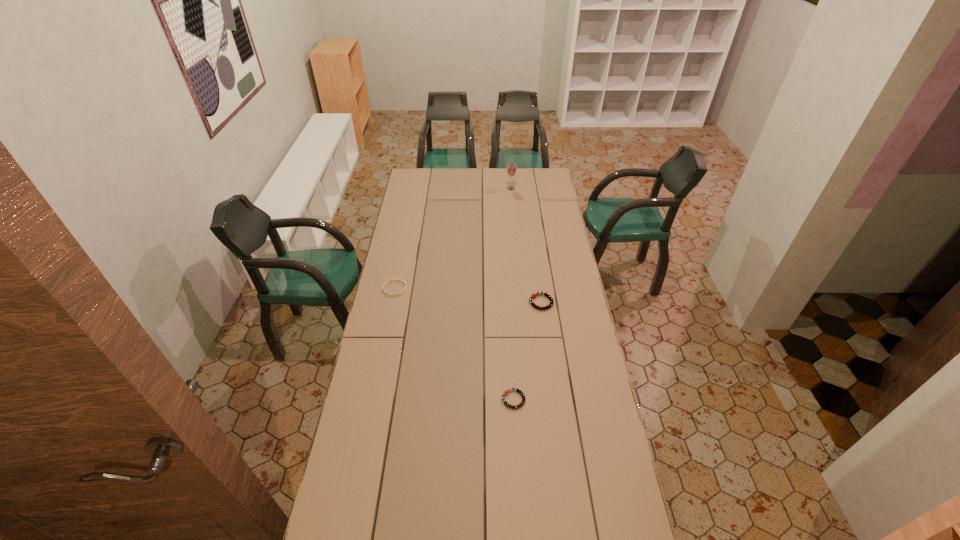
The width and height of the screenshot is (960, 540). I want to click on object located at the far edge, so click(x=511, y=168).

The width and height of the screenshot is (960, 540). I want to click on object that is at the left edge, so click(x=386, y=282).

Find the location of `object situated at the right edge`. object situated at the right edge is located at coordinates (533, 296).

Locate an element on the screen. Image resolution: width=960 pixels, height=540 pixels. vacant region at the far edge is located at coordinates (451, 177).

Where is `vacant area at the left edge`? Image resolution: width=960 pixels, height=540 pixels. vacant area at the left edge is located at coordinates (348, 424).

In the image, there is a desktop. Where is `vacant space at the right edge`? vacant space at the right edge is located at coordinates (541, 199).

In the image, there is a desktop. At what (x,y) coordinates should I click in order to perform the action: click on vacant space at the far left corner. Please return your answer as a coordinate pair (x, y). The height and width of the screenshot is (540, 960). Looking at the image, I should click on (433, 175).

Find the location of a particular element. The height and width of the screenshot is (540, 960). free space between the nearest object and the rightmost bracelet is located at coordinates (527, 351).

Find the location of a particular element. This screenshot has width=960, height=540. free spot between the tallest object and the nearest bracelet is located at coordinates (512, 294).

Image resolution: width=960 pixels, height=540 pixels. I want to click on vacant point located between the farthest object and the rightmost bracelet, so pos(526,245).